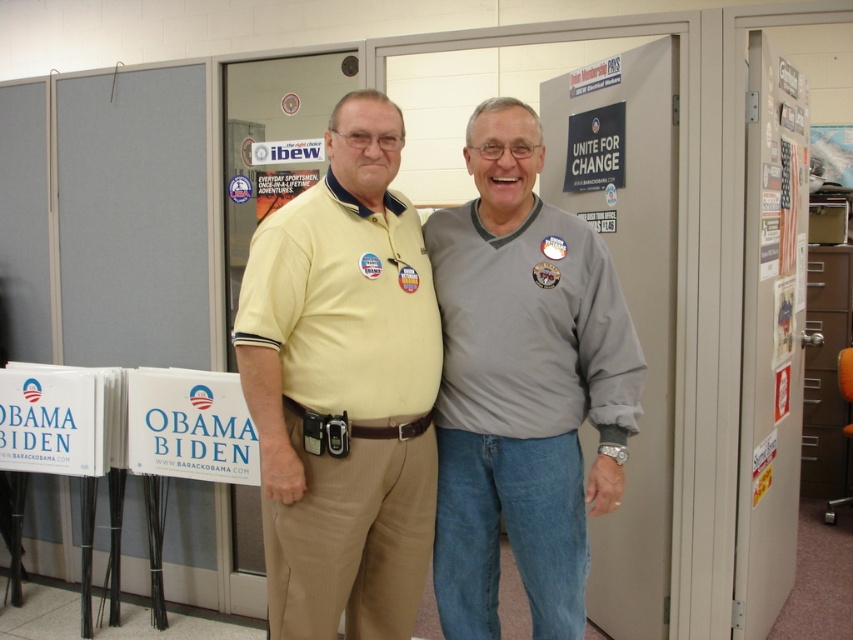
Which is more to the right, yellow cotton shirt at center or sticky notes at right?

sticky notes at right

Is yellow cotton shirt at center taller than sticky notes at right?

In fact, yellow cotton shirt at center may be shorter than sticky notes at right.

Does point (296, 209) lie behind point (758, 284)?

No, (296, 209) is in front of (758, 284).

Identify the location of yellow cotton shirt at center. (344, 388).